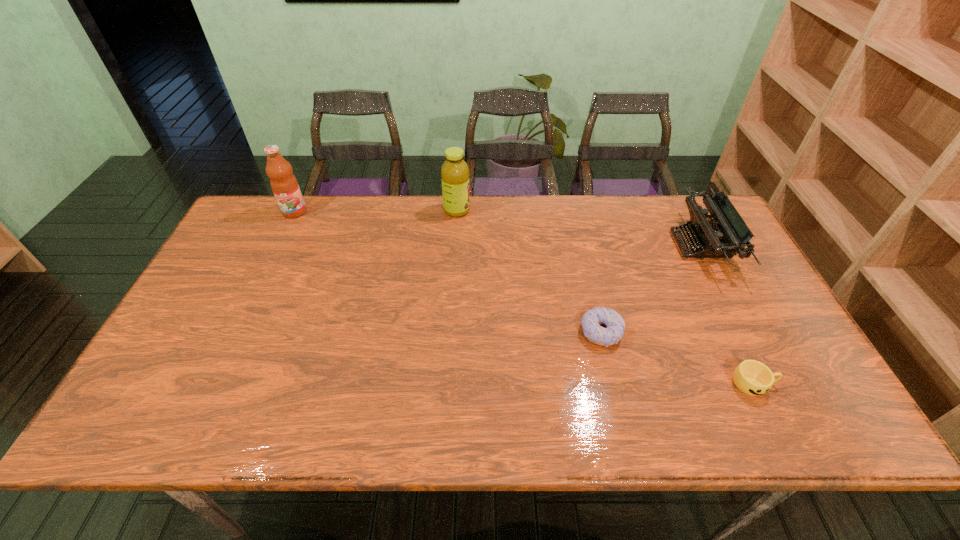
The image size is (960, 540). I want to click on blank area located 0.050m on the typing side of the typewriter, so click(659, 245).

Where is `vacant space located 0.390m on the back of the doughnut`? vacant space located 0.390m on the back of the doughnut is located at coordinates (575, 222).

What are the coordinates of `free space located 0.050m on the back of the nearest object` in the screenshot? It's located at (738, 352).

The height and width of the screenshot is (540, 960). I want to click on typewriter that is at the far edge, so click(x=725, y=235).

Identify the location of object at the near edge. Image resolution: width=960 pixels, height=540 pixels. pos(752,377).

Locate an element on the screen. The height and width of the screenshot is (540, 960). object positioned at the left edge is located at coordinates (284, 184).

The height and width of the screenshot is (540, 960). In order to click on typewriter located in the right edge section of the desktop in this screenshot , I will do `click(725, 235)`.

Find the location of a particular element. cup that is at the right edge is located at coordinates (752, 377).

Find the location of `object at the far left corner`. object at the far left corner is located at coordinates (284, 184).

Where is `object present at the far right corner`? object present at the far right corner is located at coordinates (725, 235).